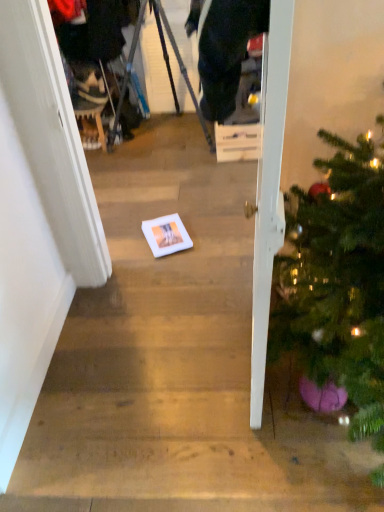
Question: Is white cardboard box at center in front of white glossy door at right?

Choices:
 (A) no
 (B) yes

Answer: (A)

Question: Is white glossy door at right surrounded by white cardboard box at center?

Choices:
 (A) no
 (B) yes

Answer: (A)

Question: Is white cardboard box at center next to white glossy door at right and touching it?

Choices:
 (A) yes
 (B) no

Answer: (B)

Question: Can you confirm if white cardboard box at center is shorter than white glossy door at right?

Choices:
 (A) no
 (B) yes

Answer: (B)

Question: Can you confirm if white cardboard box at center is taller than white glossy door at right?

Choices:
 (A) no
 (B) yes

Answer: (A)

Question: Is point (244, 138) positioned closer to the camera than point (274, 139)?

Choices:
 (A) closer
 (B) farther

Answer: (B)

Question: Is white cardboard box at center inside the boundaries of white glossy door at right, or outside?

Choices:
 (A) inside
 (B) outside

Answer: (B)

Question: In terms of size, does white cardboard box at center appear bigger or smaller than white glossy door at right?

Choices:
 (A) small
 (B) big

Answer: (A)

Question: From the image's perspective, is white cardboard box at center above or below white glossy door at right?

Choices:
 (A) above
 (B) below

Answer: (A)

Question: In terms of height, does white glossy door at right look taller or shorter compared to metallic tripod at center?

Choices:
 (A) short
 (B) tall

Answer: (B)

Question: Is white glossy door at right situated inside metallic tripod at center or outside?

Choices:
 (A) inside
 (B) outside

Answer: (B)

Question: Looking at the image, does white glossy door at right seem bigger or smaller compared to metallic tripod at center?

Choices:
 (A) big
 (B) small

Answer: (B)

Question: Is point pos(276,198) positioned closer to the camera than point pos(175,106)?

Choices:
 (A) closer
 (B) farther

Answer: (A)

Question: Considering the positions of point (221, 130) and point (135, 34), is point (221, 130) closer or farther from the camera than point (135, 34)?

Choices:
 (A) farther
 (B) closer

Answer: (B)

Question: From the image's perspective, is white cardboard box at center located above or below metallic tripod at center?

Choices:
 (A) above
 (B) below

Answer: (B)